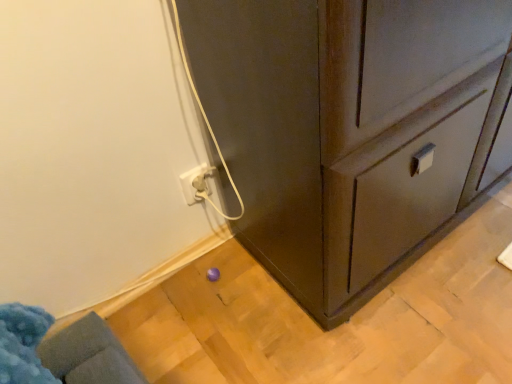
Image resolution: width=512 pixels, height=384 pixels. Describe the element at coordinates (347, 130) in the screenshot. I see `matte dark brown cupboard at lower right` at that location.

Locate an element on the screen. Image resolution: width=512 pixels, height=384 pixels. matte dark brown cupboard at lower right is located at coordinates (347, 130).

Find the location of a particular element. The width and height of the screenshot is (512, 384). matte dark brown cupboard at lower right is located at coordinates (347, 130).